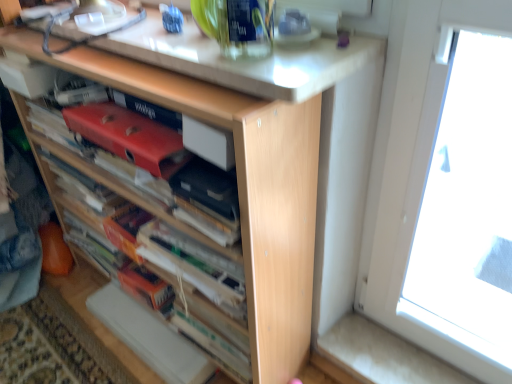
Question: Relative to matte red paperback book at center, the 2th paperback book positioned from the right, is matte black paperback book at center, the 2th paperback book from the left, in front or behind?

Choices:
 (A) front
 (B) behind

Answer: (A)

Question: Looking at their shapes, would you say matte black paperback book at center, positioned as the 1th paperback book in right-to-left order, is wider or thinner than matte red paperback book at center, the 2th paperback book positioned from the right?

Choices:
 (A) wide
 (B) thin

Answer: (B)

Question: Which is farther from the matte black paperback book at center, positioned as the 1th paperback book in right-to-left order?

Choices:
 (A) white glossy countertop at upper center
 (B) wooden book at center
 (C) matte red paperback book at center, the 2th paperback book positioned from the right

Answer: (B)

Question: Which is farther from the white glossy countertop at upper center?

Choices:
 (A) matte red paperback book at center, the 2th paperback book positioned from the right
 (B) wooden book at center
 (C) matte black paperback book at center, positioned as the 1th paperback book in right-to-left order

Answer: (B)